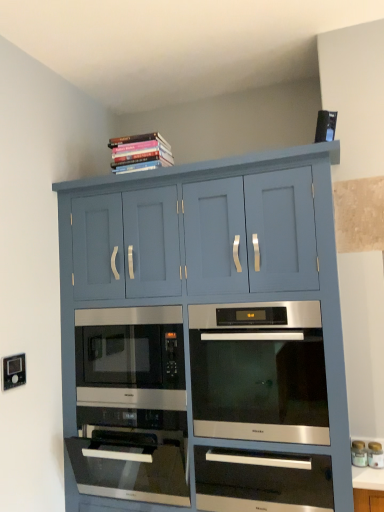
Question: Looking at the image, does satin silver drawer at center seem bigger or smaller compared to matte blue cabinet at upper center?

Choices:
 (A) big
 (B) small

Answer: (B)

Question: Is point (324, 505) closer or farther from the camera than point (77, 201)?

Choices:
 (A) closer
 (B) farther

Answer: (A)

Question: Which object is the closest to the matte blue cabinet at upper center?

Choices:
 (A) satin silver oven at center
 (B) white glossy jar at lower right, positioned as the 2th appliance in right-to-left order
 (C) matte black oven at center, placed as the 2th appliance when sorted from left to right
 (D) white glossy countertop at lower right
 (E) white plastic electric outlet at lower left

Answer: (A)

Question: Which is farther from the white glossy jar at lower right, positioned as the 2th appliance in right-to-left order?

Choices:
 (A) satin silver drawer at center
 (B) matte blue cabinet at upper center
 (C) white plastic electric outlet at lower left
 (D) hardcover books at upper center
 (E) sleek stainless steel microwave at center

Answer: (D)